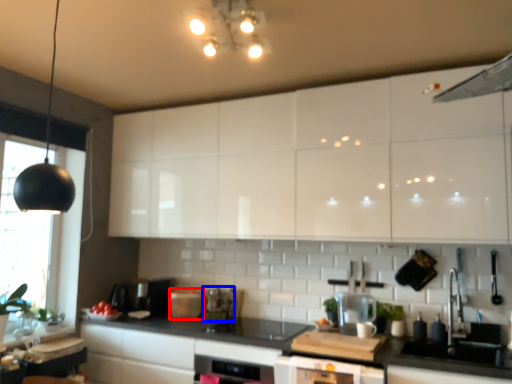
Question: Which object is closer to the camera taking this photo, appliance (highlighted by a red box) or appliance (highlighted by a blue box)?

Choices:
 (A) appliance
 (B) appliance

Answer: (A)